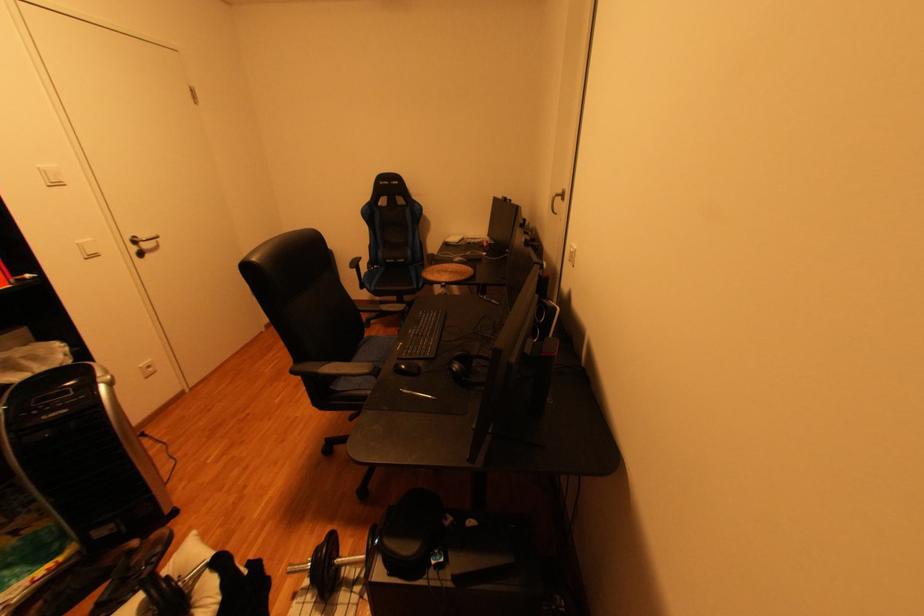
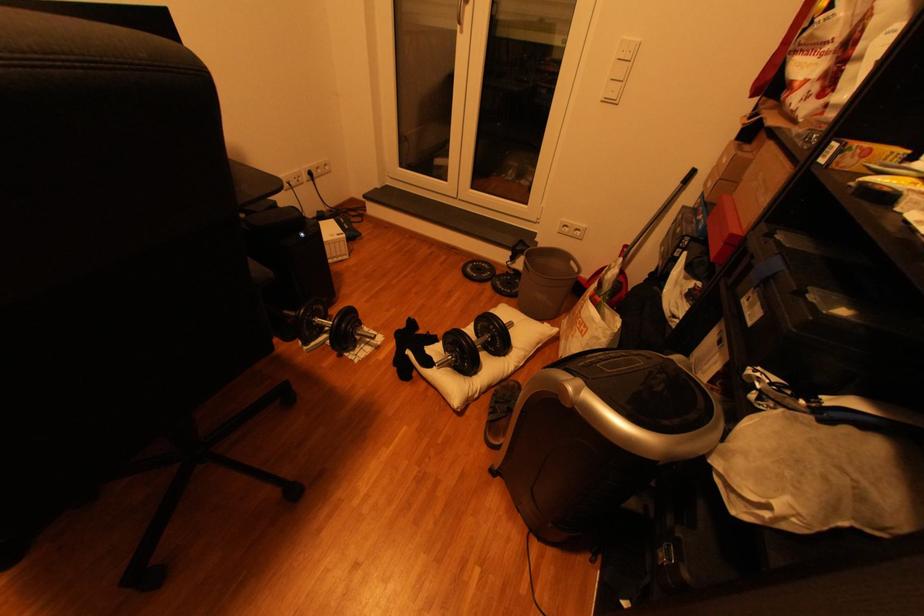
In the second image, find the point that corresponds to the point at 152,573 in the first image.

(505, 402)